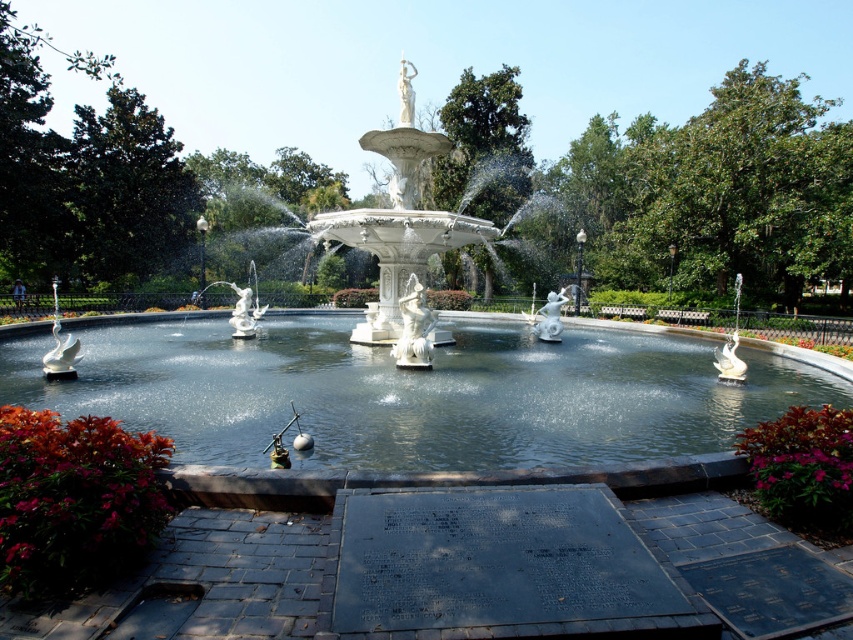
Between green leafy plant at lower left and green leafy plant at lower right, which one appears on the right side from the viewer's perspective?

From the viewer's perspective, green leafy plant at lower right appears more on the right side.

Looking at this image, between green leafy plant at lower left and green leafy plant at lower right, which one has more height?

green leafy plant at lower left

Measure the distance between point (102, 435) and camera.

Point (102, 435) and camera are 11.48 feet apart from each other.

I want to click on green leafy plant at lower left, so click(73, 499).

Does white marble fountain at center have a lesser width compared to green leafy plant at lower right?

No, white marble fountain at center is not thinner than green leafy plant at lower right.

From the picture: Between white marble fountain at center and green leafy plant at lower right, which one is positioned lower?

Positioned lower is green leafy plant at lower right.

Is point (486, 436) positioned in front of point (766, 422)?

No, (486, 436) is behind (766, 422).

Locate an element on the screen. The image size is (853, 640). white marble fountain at center is located at coordinates (399, 397).

Is point (360, 401) closer to camera compared to point (73, 492)?

No, it is behind (73, 492).

Locate an element on the screen. white marble fountain at center is located at coordinates (399, 397).